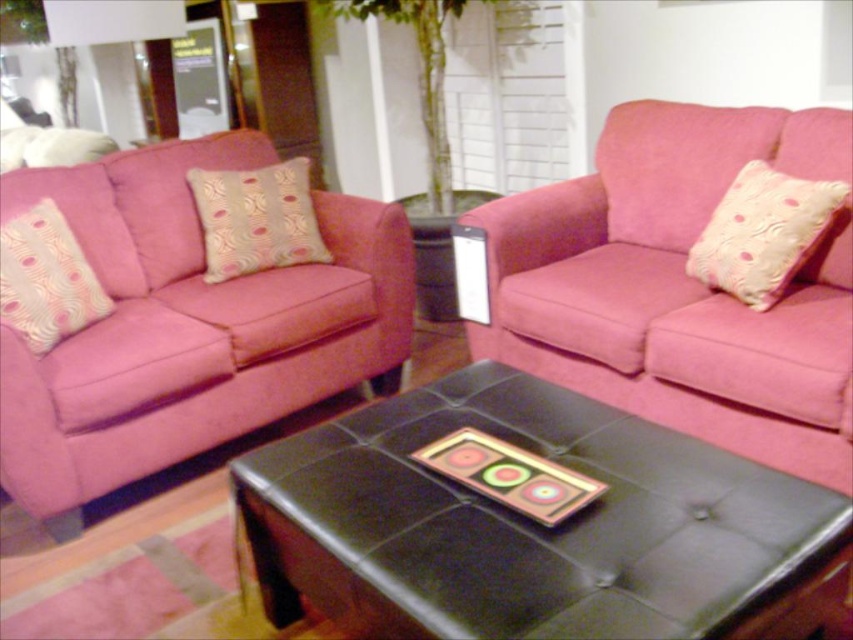
Question: Which object appears farthest from the camera in this image?

Choices:
 (A) matte pink couch at center
 (B) matte black side table at center
 (C) pink fabric pillow at left

Answer: (B)

Question: Which of the following is the farthest from the observer?

Choices:
 (A) (785, 604)
 (B) (157, 419)
 (C) (819, 275)

Answer: (C)

Question: Is black leather ottoman at center positioned behind matte pink couch at left?

Choices:
 (A) yes
 (B) no

Answer: (B)

Question: Considering the relative positions of pink fabric pillow at upper right and matte black side table at center in the image provided, where is pink fabric pillow at upper right located with respect to matte black side table at center?

Choices:
 (A) left
 (B) right

Answer: (B)

Question: Does black leather ottoman at center appear on the right side of pink fabric pillow at left?

Choices:
 (A) yes
 (B) no

Answer: (A)

Question: Which point appears closest to the camera in this image?

Choices:
 (A) (804, 179)
 (B) (82, 256)

Answer: (A)